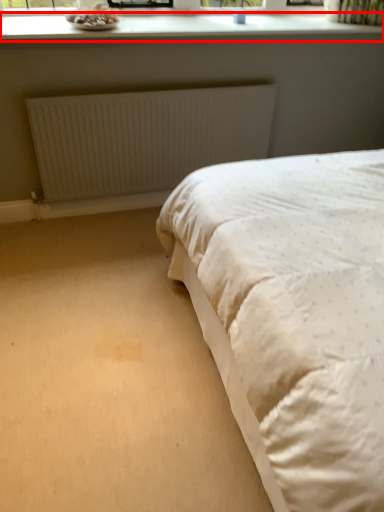
Question: Observing the image, what is the correct spatial positioning of window sill (annotated by the red box) in reference to radiator?

Choices:
 (A) left
 (B) right

Answer: (B)